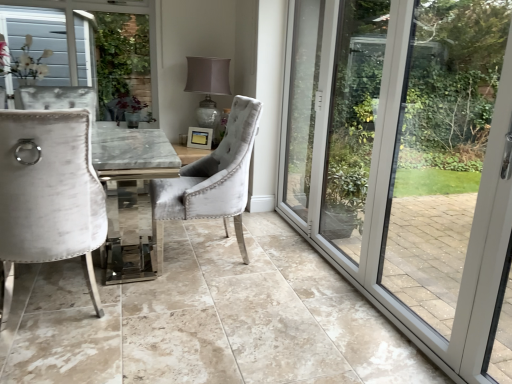
Locate an element on the screen. vacant area located to the right-hand side of velvet grey chair at center, acting as the second chair starting from the left is located at coordinates (285, 268).